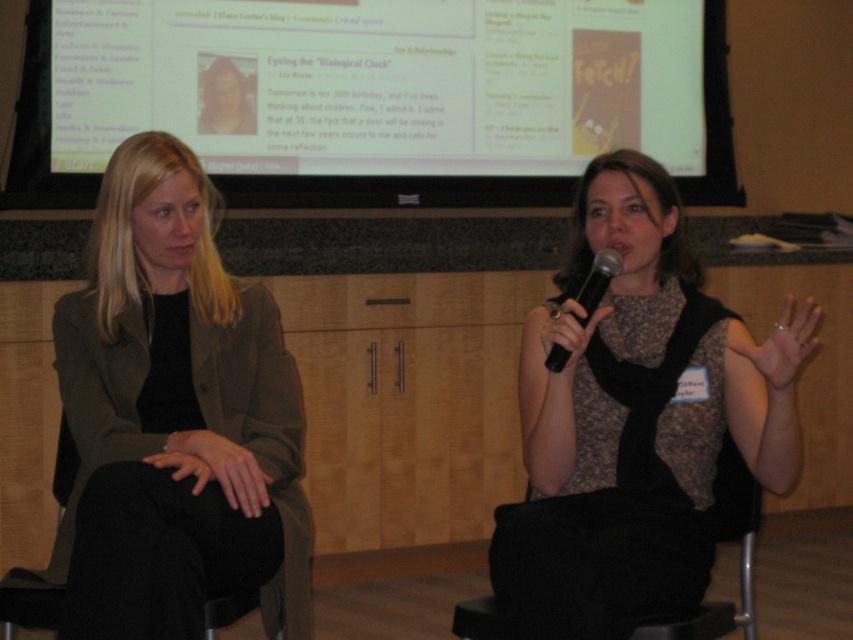
Question: Where is white glossy projection screen at upper center located in relation to knitted scarf at center in the image?

Choices:
 (A) below
 (B) above

Answer: (B)

Question: Can you confirm if matte black jacket at left is thinner than black plastic microphone at center?

Choices:
 (A) no
 (B) yes

Answer: (A)

Question: Does matte black jacket at left have a greater width compared to black fabric chair at lower right?

Choices:
 (A) no
 (B) yes

Answer: (B)

Question: Which of the following is the closest to the observer?

Choices:
 (A) black plastic microphone at center
 (B) matte black jacket at left

Answer: (B)

Question: Which object is the farthest from the matte black jacket at left?

Choices:
 (A) black fabric chair at lower right
 (B) black plastic microphone at center
 (C) knitted scarf at center

Answer: (A)

Question: Which object is the closest to the black plastic microphone at center?

Choices:
 (A) white glossy projection screen at upper center
 (B) matte black jacket at left
 (C) knitted scarf at center
 (D) black fabric chair at lower right

Answer: (C)